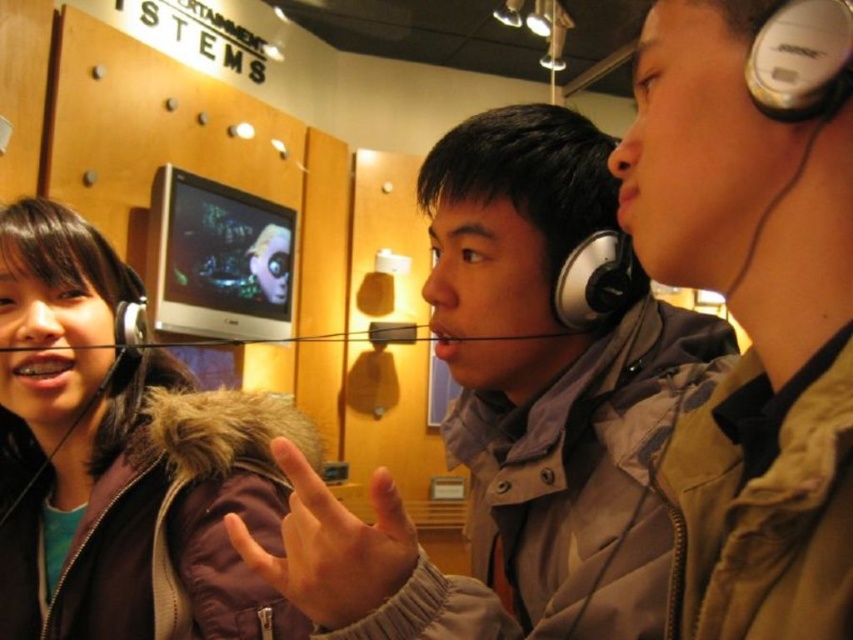
Question: Can you confirm if brown fuzzy jacket at left is positioned to the left of matte silver earphone at left?

Choices:
 (A) yes
 (B) no

Answer: (A)

Question: Can you confirm if brown fuzzy jacket at left is positioned to the right of satin silver headphones at center?

Choices:
 (A) yes
 (B) no

Answer: (B)

Question: Estimate the real-world distances between objects in this image. Which object is closer to the satin silver headphones at center?

Choices:
 (A) gray matte jacket at center
 (B) brown fuzzy jacket at left

Answer: (A)

Question: Based on their relative distances, which object is farther from the brown fuzzy jacket at left?

Choices:
 (A) satin silver headphones at center
 (B) matte silver earphone at left
 (C) gray matte jacket at center

Answer: (A)

Question: Does gray matte jacket at center appear over brown fuzzy jacket at left?

Choices:
 (A) no
 (B) yes

Answer: (B)

Question: Which object is farther from the camera taking this photo?

Choices:
 (A) satin silver headphones at center
 (B) matte silver earphone at left
 (C) brown fuzzy jacket at left

Answer: (B)